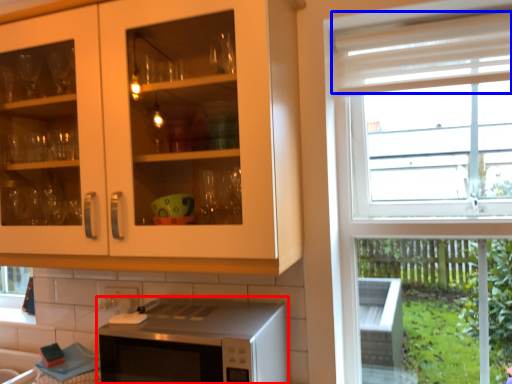
Question: Which object is further to the camera taking this photo, microwave oven (highlighted by a red box) or curtain (highlighted by a blue box)?

Choices:
 (A) microwave oven
 (B) curtain

Answer: (B)